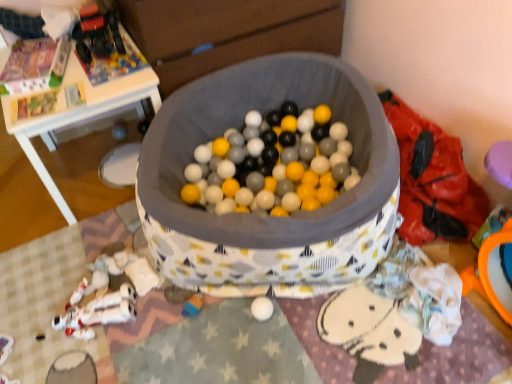
At what (x,y) coordinates should I click in order to perform the action: click on vacant area to the left of white matte plastic toy at lower left, placed as the second toy when sorted from top to bottom. Please return your answer as a coordinate pair (x, y). The width and height of the screenshot is (512, 384). Looking at the image, I should click on (61, 277).